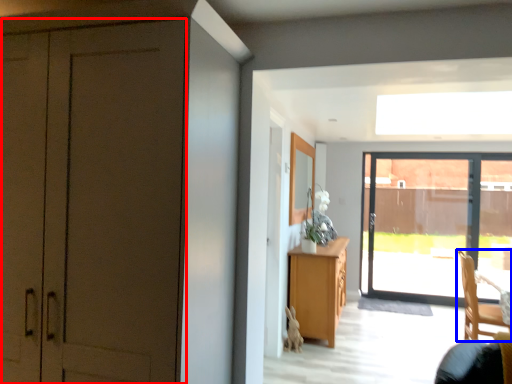
Question: Which point is further to the camera, door (highlighted by a red box) or chair (highlighted by a blue box)?

Choices:
 (A) door
 (B) chair

Answer: (B)